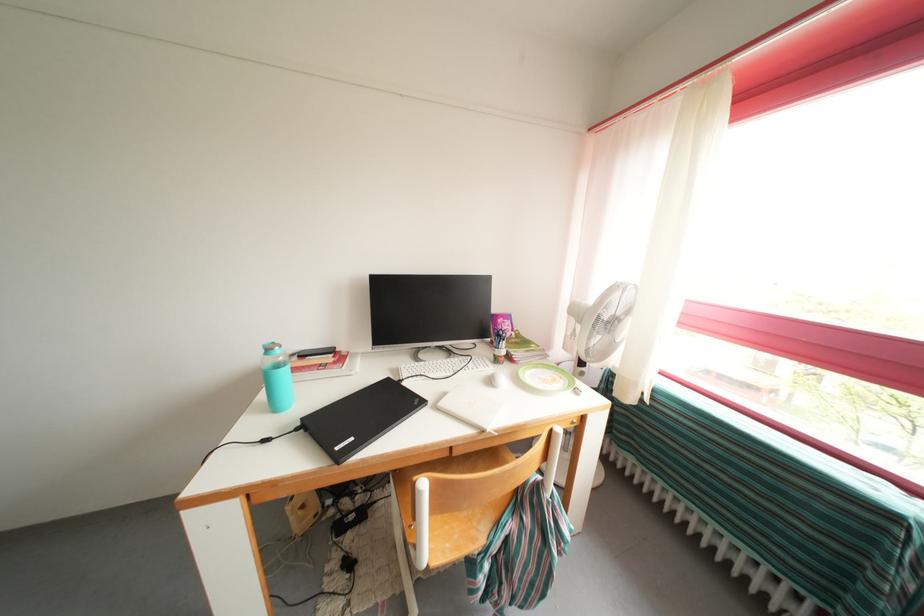
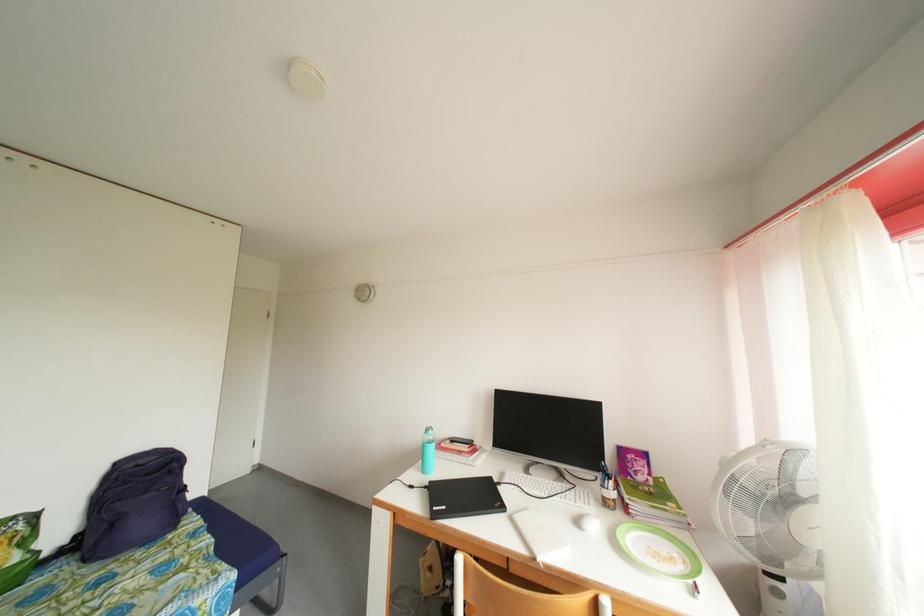
In the second image, find the point that corresponds to point 275,355 in the first image.

(434, 436)